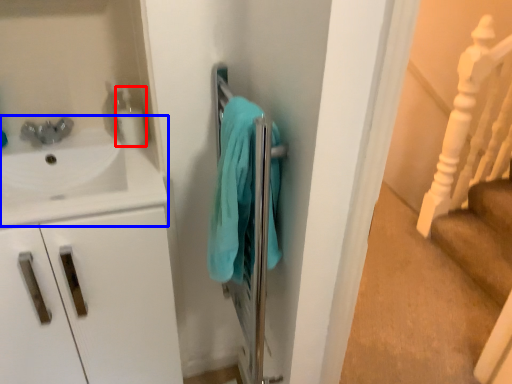
Question: Which object appears closest to the camera in this image, soap dispenser (highlighted by a red box) or sink (highlighted by a blue box)?

Choices:
 (A) soap dispenser
 (B) sink

Answer: (B)